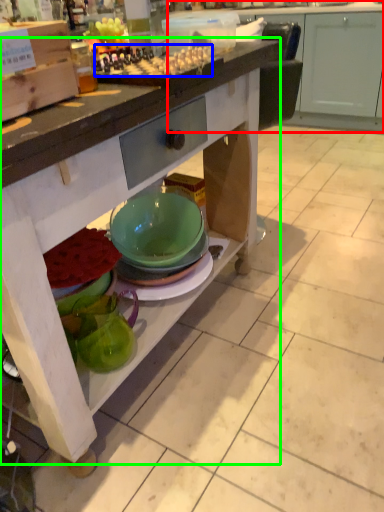
Question: Estimate the real-world distances between objects in this image. Which object is closer to cabinetry (highlighted by a red box), food (highlighted by a blue box) or table (highlighted by a green box)?

Choices:
 (A) food
 (B) table

Answer: (B)